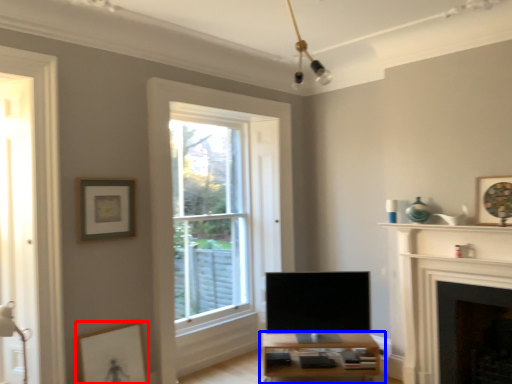
Question: Which object is further to the camera taking this photo, picture frame (highlighted by a red box) or table (highlighted by a blue box)?

Choices:
 (A) picture frame
 (B) table

Answer: (B)